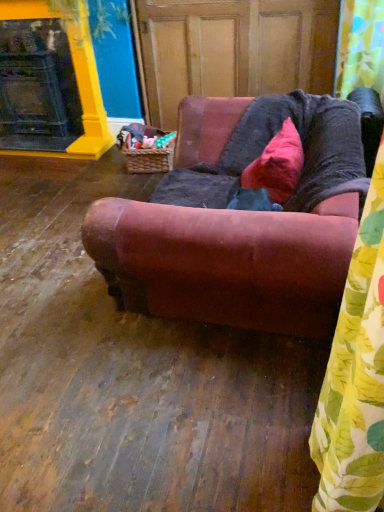
What is the approximate width of pink velvet pillow at upper center?

pink velvet pillow at upper center is 11.92 inches in width.

What is the approximate width of wooden screen door at center?

22.24 inches.

Find the location of a particular element. The image size is (384, 512). velvet brown couch at center is located at coordinates (240, 221).

The image size is (384, 512). What do you see at coordinates (149, 159) in the screenshot? I see `woven brown basket at lower left` at bounding box center [149, 159].

What do you see at coordinates (360, 46) in the screenshot? The height and width of the screenshot is (512, 384). I see `yellow floral fabric shower curtain at upper right` at bounding box center [360, 46].

At what (x,y) coordinates should I click in order to perform the action: click on pink velvet pillow at upper center. Please return your answer as a coordinate pair (x, y). This screenshot has height=512, width=384. Looking at the image, I should click on (277, 165).

Which object is positioned more to the right, woven brown basket at lower left or wooden screen door at center?

Positioned to the right is wooden screen door at center.

Looking at their sizes, would you say woven brown basket at lower left is wider or thinner than wooden screen door at center?

woven brown basket at lower left is thinner than wooden screen door at center.

Is woven brown basket at lower left not inside wooden screen door at center?

Yes, woven brown basket at lower left is outside of wooden screen door at center.

Who is taller, woven brown basket at lower left or wooden screen door at center?

Standing taller between the two is wooden screen door at center.

Is wooden screen door at center positioned with its back to woven brown basket at lower left?

wooden screen door at center is not turned away from woven brown basket at lower left.

Measure the distance between wooden screen door at center and woven brown basket at lower left.

The distance of wooden screen door at center from woven brown basket at lower left is 75.12 centimeters.

From a real-world perspective, who is located higher, wooden screen door at center or woven brown basket at lower left?

In real-world perspective, wooden screen door at center is above.

Does wooden screen door at center appear on the left side of woven brown basket at lower left?

No.

In order to click on shower curtain in front of the woven brown basket at lower left in this screenshot , I will do `click(360, 46)`.

Considering the positions of objects woven brown basket at lower left and yellow floral fabric shower curtain at upper right in the image provided, who is more to the left, woven brown basket at lower left or yellow floral fabric shower curtain at upper right?

From the viewer's perspective, woven brown basket at lower left appears more on the left side.

From a real-world perspective, who is located lower, woven brown basket at lower left or yellow floral fabric shower curtain at upper right?

woven brown basket at lower left, from a real-world perspective.

Can you confirm if woven brown basket at lower left is smaller than yellow floral fabric shower curtain at upper right?

Yes.

Between matte yellow fireplace at upper left and wooden screen door at center, which one appears on the left side from the viewer's perspective?

matte yellow fireplace at upper left is more to the left.

Is matte yellow fireplace at upper left placed right next to wooden screen door at center?

There is a gap between matte yellow fireplace at upper left and wooden screen door at center.

Is matte yellow fireplace at upper left closer to camera compared to wooden screen door at center?

No, matte yellow fireplace at upper left is further to the viewer.

Is matte yellow fireplace at upper left oriented away from wooden screen door at center?

No, matte yellow fireplace at upper left is not facing the opposite direction of wooden screen door at center.

Is velvet brown couch at center further to camera compared to woven brown basket at lower left?

No, velvet brown couch at center is in front of woven brown basket at lower left.

From the image's perspective, which one is positioned lower, velvet brown couch at center or woven brown basket at lower left?

velvet brown couch at center is shown below in the image.

From a real-world perspective, who is located lower, velvet brown couch at center or woven brown basket at lower left?

From a 3D spatial view, woven brown basket at lower left is below.

Who is bigger, wooden screen door at center or matte yellow fireplace at upper left?

With larger size is wooden screen door at center.

Looking at this image, is the depth of wooden screen door at center greater than that of matte yellow fireplace at upper left?

That is False.

Is the surface of wooden screen door at center in direct contact with matte yellow fireplace at upper left?

No.

Is wooden screen door at center oriented away from matte yellow fireplace at upper left?

That's not correct — wooden screen door at center is not looking away from matte yellow fireplace at upper left.

From a real-world perspective, who is located lower, matte yellow fireplace at upper left or velvet brown couch at center?

In real-world perspective, velvet brown couch at center is lower.

Does point (13, 40) appear closer or farther from the camera than point (271, 109)?

Point (13, 40).

Is matte yellow fireplace at upper left directly adjacent to velvet brown couch at center?

They are not placed beside each other.

What are the coordinates of `screen door that appears on the right of woven brown basket at lower left` in the screenshot? It's located at (234, 49).

This screenshot has height=512, width=384. I want to click on basket on the left of the wooden screen door at center, so tap(149, 159).

When comparing their distances from matte yellow fireplace at upper left, does wooden screen door at center or woven brown basket at lower left seem closer?

The object closer to matte yellow fireplace at upper left is woven brown basket at lower left.

When comparing their distances from yellow floral fabric shower curtain at upper right, does matte yellow fireplace at upper left or wooden screen door at center seem closer?

The object closer to yellow floral fabric shower curtain at upper right is wooden screen door at center.

Estimate the real-world distances between objects in this image. Which object is further from woven brown basket at lower left, velvet brown couch at center or pink velvet pillow at upper center?

velvet brown couch at center is further to woven brown basket at lower left.

From the image, which object appears to be nearer to woven brown basket at lower left, wooden screen door at center or yellow floral fabric shower curtain at upper right?

wooden screen door at center.

Based on the photo, when comparing their distances from matte yellow fireplace at upper left, does wooden screen door at center or yellow floral fabric shower curtain at upper right seem closer?

Based on the image, wooden screen door at center appears to be nearer to matte yellow fireplace at upper left.

Looking at the image, which one is located closer to velvet brown couch at center, woven brown basket at lower left or wooden screen door at center?

woven brown basket at lower left is positioned closer to the anchor velvet brown couch at center.

Looking at this image, considering their positions, is matte yellow fireplace at upper left positioned closer to woven brown basket at lower left than wooden screen door at center?

wooden screen door at center lies closer to woven brown basket at lower left than the other object.

When comparing their distances from pink velvet pillow at upper center, does matte yellow fireplace at upper left or velvet brown couch at center seem closer?

Based on the image, velvet brown couch at center appears to be nearer to pink velvet pillow at upper center.

Where is `pillow between velvet brown couch at center and yellow floral fabric shower curtain at upper right in the front-back direction`? pillow between velvet brown couch at center and yellow floral fabric shower curtain at upper right in the front-back direction is located at coordinates tap(277, 165).

Where is `studio couch between matte yellow fireplace at upper left and yellow floral fabric shower curtain at upper right in the horizontal direction`? Image resolution: width=384 pixels, height=512 pixels. studio couch between matte yellow fireplace at upper left and yellow floral fabric shower curtain at upper right in the horizontal direction is located at coordinates (240, 221).

I want to click on pillow located between velvet brown couch at center and woven brown basket at lower left in the depth direction, so click(x=277, y=165).

The width and height of the screenshot is (384, 512). What are the coordinates of `pillow between woven brown basket at lower left and yellow floral fabric shower curtain at upper right from left to right` in the screenshot? It's located at (277, 165).